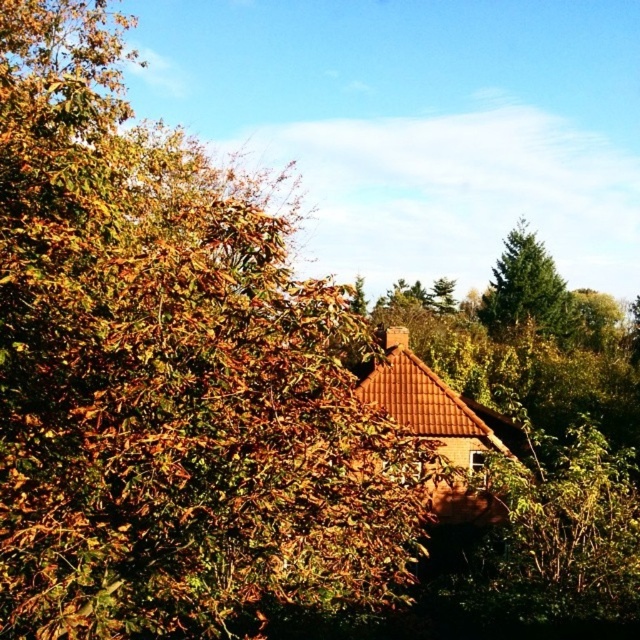
You are planning to plant a new tree in your backyard and have two options based on the image. The brown leafy tree at center and the green fir tree at upper right. If you want a wider tree for shade, which one should you choose?

The brown leafy tree at center has a larger width than the green fir tree at upper right, so it would be the better choice for shade due to its wider spread.

Consider the image. You are standing in front of the house and want to plant a new tree that needs more sunlight. Which tree, the brown leafy tree at center or the green fir tree at upper right, should you consider removing to allow more sunlight to reach the area?

The brown leafy tree at center has a greater height compared to the green fir tree at upper right, so removing it would allow more sunlight to reach the area.